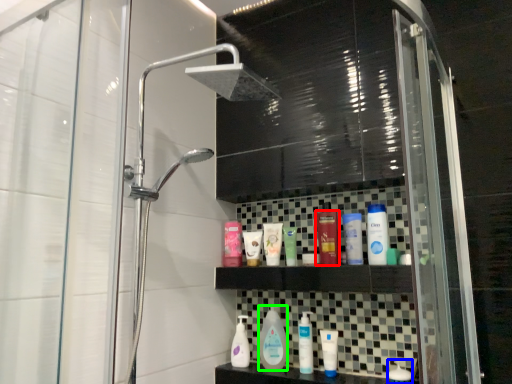
Question: Based on their relative distances, which object is nearer to toiletry (highlighted by a red box)? Choose from toiletry (highlighted by a blue box) and cleaning product (highlighted by a green box).

Choices:
 (A) toiletry
 (B) cleaning product

Answer: (B)